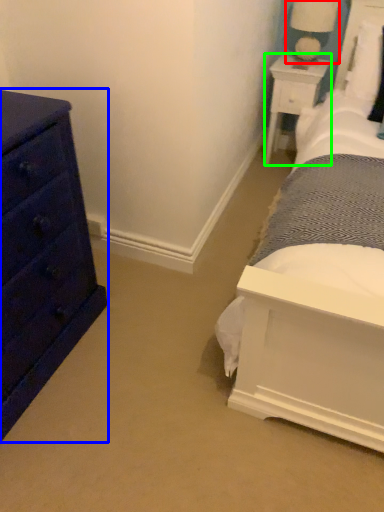
Question: Estimate the real-world distances between objects in this image. Which object is farther from table lamp (highlighted by a red box), chest of drawers (highlighted by a blue box) or nightstand (highlighted by a green box)?

Choices:
 (A) chest of drawers
 (B) nightstand

Answer: (A)